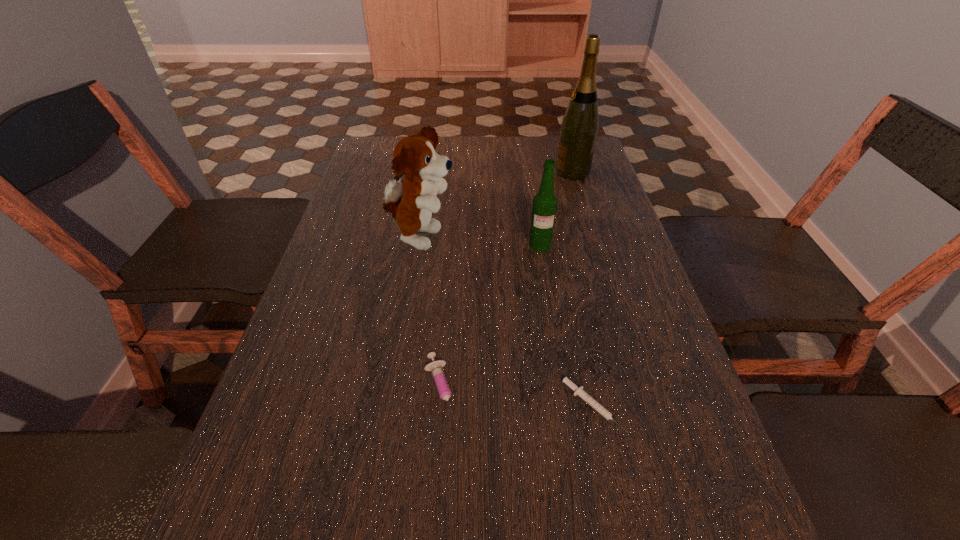
At what (x,y) coordinates should I click in order to perform the action: click on vacant space at the far edge of the desktop. Please return your answer as a coordinate pair (x, y). Image resolution: width=960 pixels, height=540 pixels. Looking at the image, I should click on (541, 148).

Locate an element on the screen. This screenshot has height=540, width=960. free spot at the left edge of the desktop is located at coordinates (371, 231).

Find the location of `vacant region at the right edge`. vacant region at the right edge is located at coordinates (666, 427).

Where is `blank space at the far left corner of the desktop`? blank space at the far left corner of the desktop is located at coordinates (367, 157).

Image resolution: width=960 pixels, height=540 pixels. I want to click on vacant point located between the taller syringe and the wine bottle, so click(x=507, y=282).

The height and width of the screenshot is (540, 960). What are the coordinates of `free space between the wine bottle and the right syringe` in the screenshot? It's located at (583, 289).

You are a GUI agent. You are given a task and a screenshot of the screen. Output one action in this format:
    pyautogui.click(x=<x>, y=<y>)
    Task: Click on the empty space between the puppy and the third shortest object
    The height and width of the screenshot is (540, 960).
    Given the screenshot: What is the action you would take?
    pyautogui.click(x=480, y=242)

This screenshot has height=540, width=960. What are the coordinates of `vacant space that's between the left syringe and the tallest object` in the screenshot? It's located at (507, 282).

In order to click on free space between the fourth shortest object and the wine bottle in this screenshot , I will do `click(496, 206)`.

Locate an element on the screen. The height and width of the screenshot is (540, 960). blank region between the shorter syringe and the tallest object is located at coordinates (583, 289).